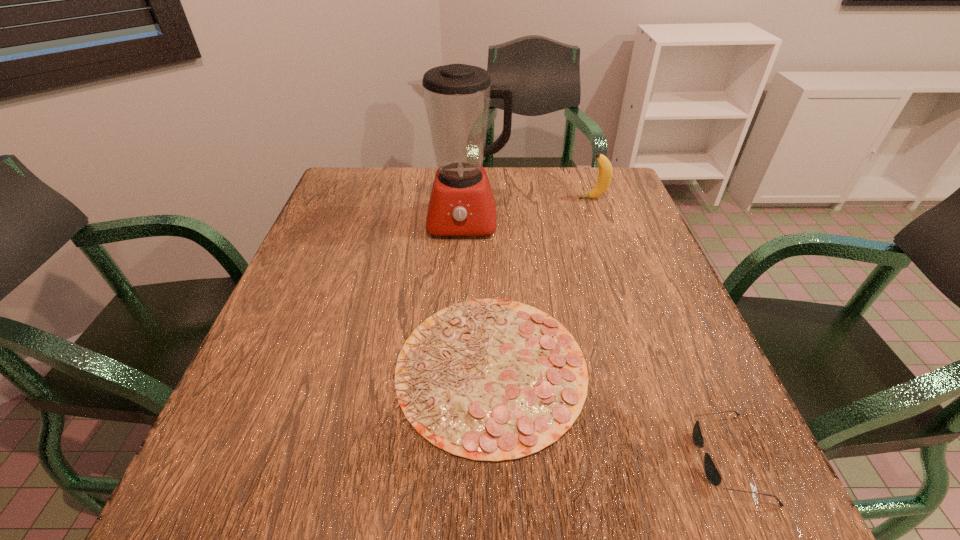
Where is `vacant space that satisfies the following two spatial constraints: 1. on the front of the third nearest object near the controls; 2. on the left side of the pizza`? This screenshot has width=960, height=540. vacant space that satisfies the following two spatial constraints: 1. on the front of the third nearest object near the controls; 2. on the left side of the pizza is located at coordinates (456, 368).

I want to click on vacant space that satisfies the following two spatial constraints: 1. on the front of the pizza near the controls; 2. on the left side of the blender, so click(456, 368).

Locate an element on the screen. Image resolution: width=960 pixels, height=540 pixels. vacant area that satisfies the following two spatial constraints: 1. on the front of the third nearest object near the controls; 2. on the right side of the pizza is located at coordinates click(x=456, y=368).